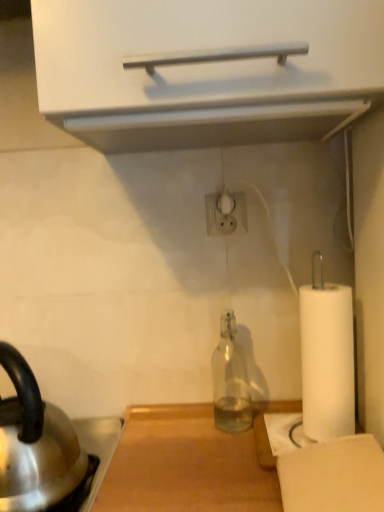
Question: Is transparent glass bottle at center inside or outside of shiny metallic kettle at lower left?

Choices:
 (A) inside
 (B) outside

Answer: (B)

Question: Considering the relative positions of transparent glass bottle at center and shiny metallic kettle at lower left in the image provided, is transparent glass bottle at center to the left or to the right of shiny metallic kettle at lower left?

Choices:
 (A) left
 (B) right

Answer: (B)

Question: Looking at the image, does transparent glass bottle at center seem bigger or smaller compared to shiny metallic kettle at lower left?

Choices:
 (A) big
 (B) small

Answer: (B)

Question: From a real-world perspective, is shiny metallic kettle at lower left above or below transparent glass bottle at center?

Choices:
 (A) below
 (B) above

Answer: (B)

Question: Is point (79, 477) closer or farther from the camera than point (215, 370)?

Choices:
 (A) closer
 (B) farther

Answer: (A)

Question: Is shiny metallic kettle at lower left taller or shorter than transparent glass bottle at center?

Choices:
 (A) tall
 (B) short

Answer: (A)

Question: From the image's perspective, is shiny metallic kettle at lower left located above or below transparent glass bottle at center?

Choices:
 (A) below
 (B) above

Answer: (A)